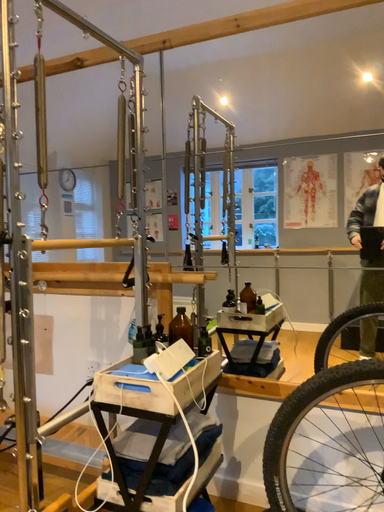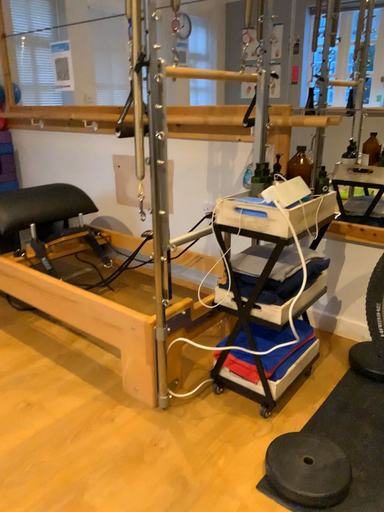
Question: Which way did the camera rotate in the video?

Choices:
 (A) rotated right
 (B) rotated left

Answer: (B)